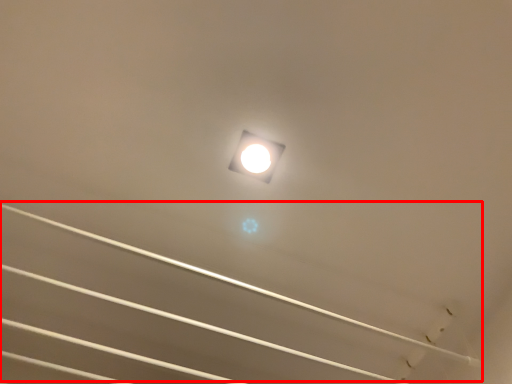
Question: From the image's perspective, where is line (annotated by the red box) located in relation to lamp in the image?

Choices:
 (A) above
 (B) below

Answer: (B)